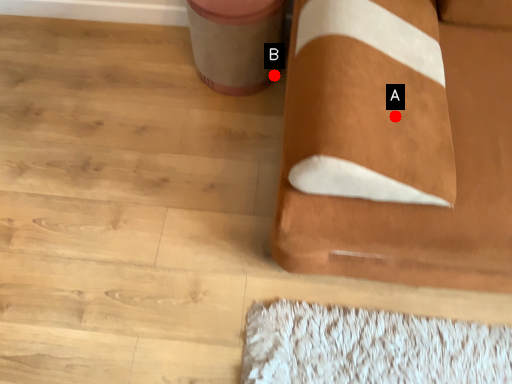
Question: Two points are circled on the image, labeled by A and B beside each circle. Which point is closer to the camera taking this photo?

Choices:
 (A) A is closer
 (B) B is closer

Answer: (A)